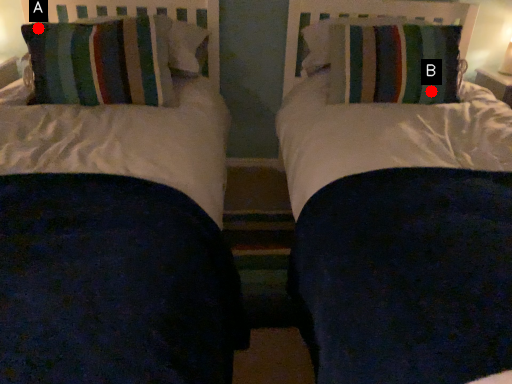
Question: Two points are circled on the image, labeled by A and B beside each circle. Which point appears closest to the camera in this image?

Choices:
 (A) A is closer
 (B) B is closer

Answer: (A)